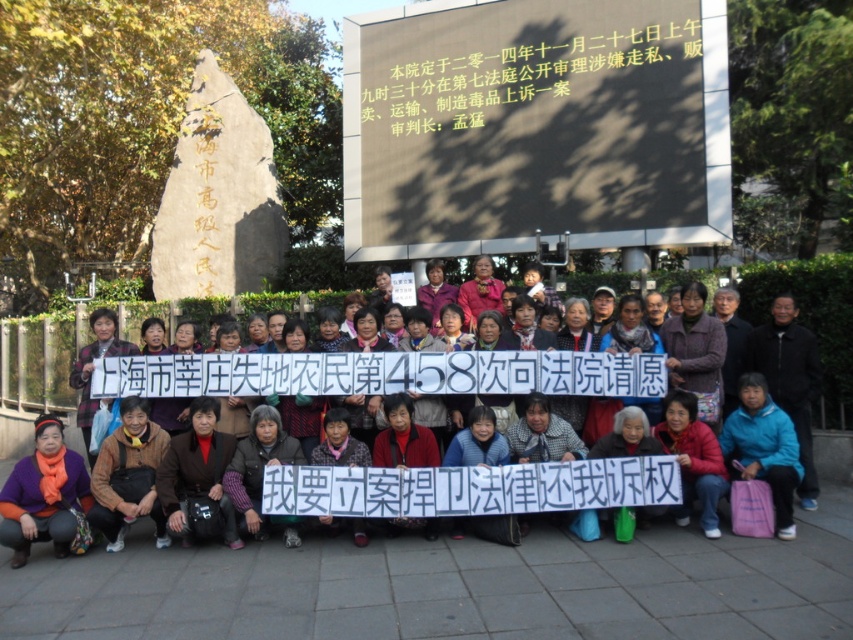
Question: Which point appears closest to the camera in this image?

Choices:
 (A) (561, 408)
 (B) (44, 518)

Answer: (B)

Question: Observing the image, what is the correct spatial positioning of blue fabric scarf at center in reference to orange scarf at lower left?

Choices:
 (A) above
 (B) below

Answer: (A)

Question: Can you confirm if blue fabric scarf at center is positioned below orange scarf at lower left?

Choices:
 (A) yes
 (B) no

Answer: (B)

Question: Which point is closer to the camera taking this photo?

Choices:
 (A) (10, 508)
 (B) (581, 275)

Answer: (A)

Question: Is blue fabric scarf at center closer to camera compared to orange scarf at lower left?

Choices:
 (A) no
 (B) yes

Answer: (A)